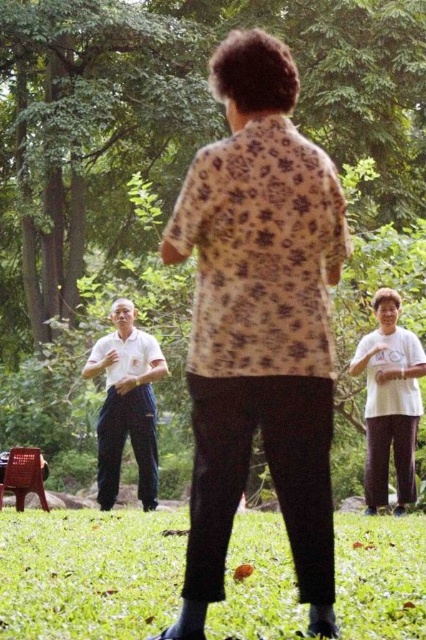
You are standing in the park and want to take a photo of the green leafy tree at upper center. If your camera can focus on objects up to 15 meters away, will it be able to capture a clear image of the tree?

The green leafy tree at upper center is 13.30 meters away from the viewer. Since the camera can focus up to 15 meters, it will be able to capture a clear image of the tree.

You are a photographer trying to capture a photo of the white smooth shirt at left without the green leafy tree at upper center blocking the view. Which direction should you move to ensure the tree is out of frame?

Move to the left side so that the green leafy tree at upper center is no longer above the white smooth shirt at left.